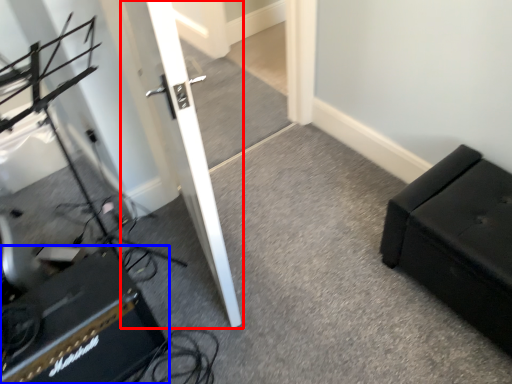
Question: Which point is further to the camera, door (highlighted by a red box) or speaker (highlighted by a blue box)?

Choices:
 (A) door
 (B) speaker

Answer: (B)